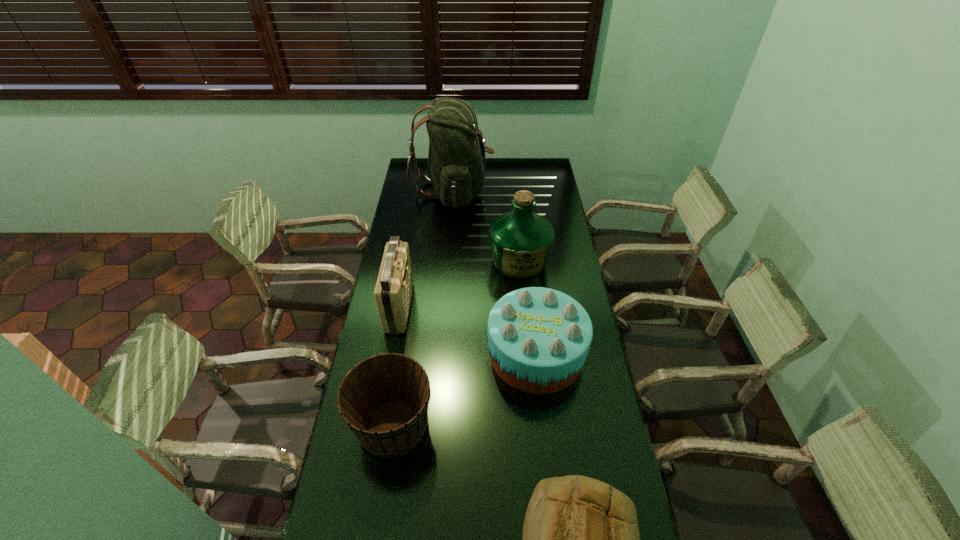
Find the location of a particular element. This screenshot has width=960, height=540. backpack is located at coordinates point(456,160).

Image resolution: width=960 pixels, height=540 pixels. Find the location of `the tallest object`. the tallest object is located at coordinates (456, 160).

Find the location of `liquor`. liquor is located at coordinates (521, 240).

Identify the location of the third tallest object. The width and height of the screenshot is (960, 540). (393, 291).

At what (x,y) coordinates should I click in order to perform the action: click on cake. Please return your answer as a coordinate pair (x, y). Looking at the image, I should click on (538, 338).

Image resolution: width=960 pixels, height=540 pixels. I want to click on wine bucket, so click(x=384, y=400).

Locate an element on the screen. Image resolution: width=960 pixels, height=540 pixels. free spot located 0.090m on the open flap of the tallest object is located at coordinates (511, 191).

At what (x,y) coordinates should I click in order to perform the action: click on free region located on the label side of the liquor. Please return your answer as a coordinate pair (x, y). Looking at the image, I should click on (524, 313).

At what (x,y) coordinates should I click in order to perform the action: click on vacant position located 0.170m on the front-facing side of the fourth shortest object. Please return your answer as a coordinate pair (x, y). This screenshot has width=960, height=540. Looking at the image, I should click on (454, 307).

Find the location of a particular element. vacant space located 0.150m on the left of the cake is located at coordinates (444, 354).